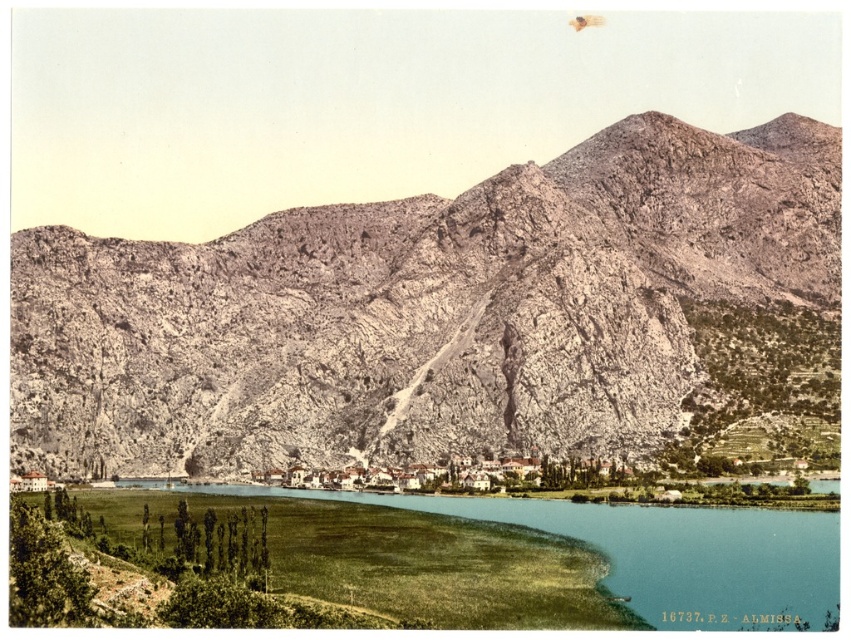
Based on the photo, you are a hiker planning to cross the rugged stone mountain range at center. You notice the green grassy water at lower center. Which direction should you head to avoid the water?

The green grassy water at lower center is behind the rugged stone mountain range at center, so to avoid the water, you should head towards the direction opposite of the water, which would be in front of the rugged stone mountain range at center.

You are planning a hiking trip and need to know if the rugged stone mountain range at center is larger than the green grassy water at lower center. Can you confirm this based on the scene?

The rugged stone mountain range at center is bigger than the green grassy water at lower center, so yes, the rugged stone mountain range at center is larger than the green grassy water at lower center.